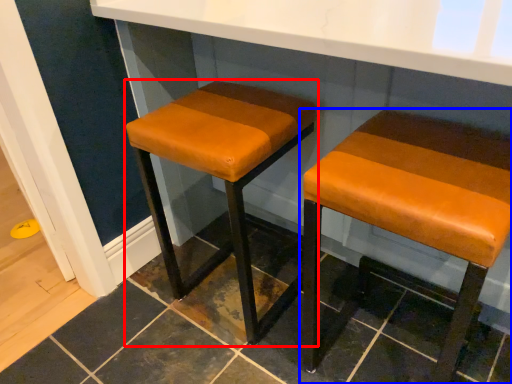
Question: Which point is further to the camera, stool (highlighted by a red box) or stool (highlighted by a blue box)?

Choices:
 (A) stool
 (B) stool

Answer: (A)